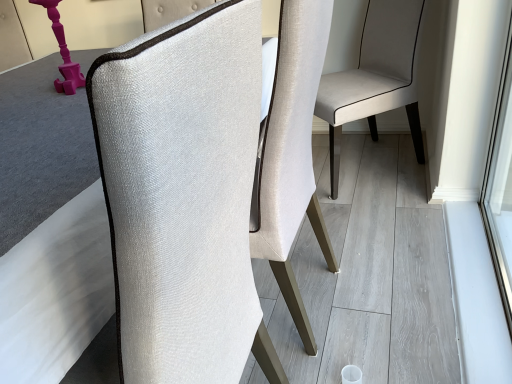
Question: Looking at their shapes, would you say matte pink plastic table lamp at left is wider or thinner than textured fabric chair at center, the second chair positioned from the back?

Choices:
 (A) wide
 (B) thin

Answer: (B)

Question: Choose the correct answer: Is matte pink plastic table lamp at left inside textured fabric chair at center, the second chair positioned from the back, or outside it?

Choices:
 (A) outside
 (B) inside

Answer: (A)

Question: Which of these objects is positioned closest to the textured fabric chair at center, placed as the 1th chair when sorted from front to back?

Choices:
 (A) matte pink plastic table lamp at left
 (B) textured beige chair at center, which ranks as the 1th chair in back-to-front order

Answer: (A)

Question: Based on their relative distances, which object is farther from the matte pink plastic table lamp at left?

Choices:
 (A) textured fabric chair at center, the second chair positioned from the back
 (B) textured beige chair at center, which ranks as the 1th chair in back-to-front order

Answer: (B)